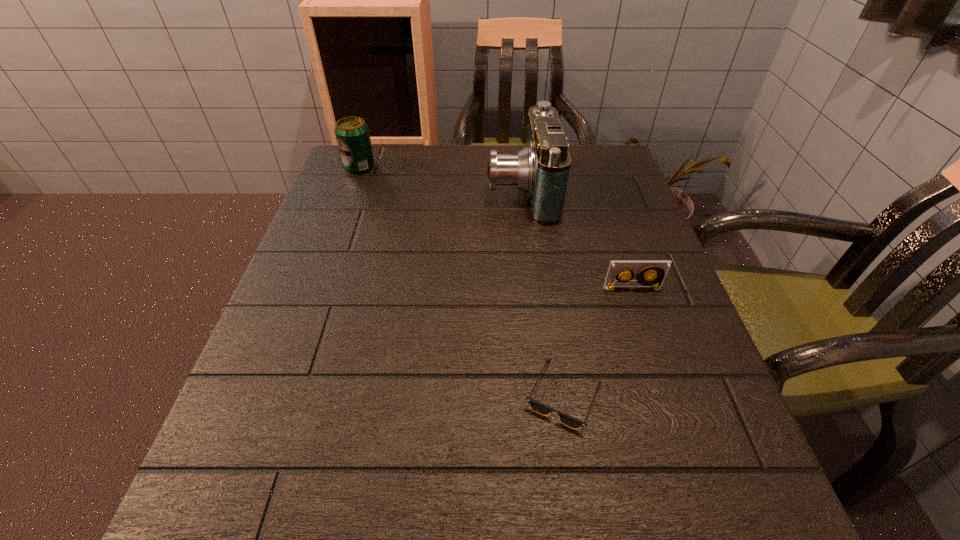
Where is `vacant space at the left edge of the desktop`? Image resolution: width=960 pixels, height=540 pixels. vacant space at the left edge of the desktop is located at coordinates (376, 236).

This screenshot has width=960, height=540. Find the location of `vacant point at the right edge`. vacant point at the right edge is located at coordinates (600, 256).

At what (x,y) coordinates should I click in order to perform the action: click on vacant space at the far left corner. Please return your answer as a coordinate pair (x, y). This screenshot has width=960, height=540. Looking at the image, I should click on (384, 161).

In the image, there is a desktop. Where is `vacant space at the far right corner`? Image resolution: width=960 pixels, height=540 pixels. vacant space at the far right corner is located at coordinates (602, 147).

This screenshot has height=540, width=960. I want to click on free space at the near right corner, so click(741, 512).

Locate an element on the screen. The height and width of the screenshot is (540, 960). vacant point located between the shortest object and the tallest object is located at coordinates (542, 292).

At what (x,y) coordinates should I click in order to perform the action: click on vacant area that lies between the second nearest object and the second tallest object. Please return your answer as a coordinate pair (x, y). Image resolution: width=960 pixels, height=540 pixels. Looking at the image, I should click on (496, 228).

Locate an element on the screen. Image resolution: width=960 pixels, height=540 pixels. free spot between the shortest object and the leftmost object is located at coordinates (462, 281).

Where is `blank region between the second nearest object and the beer can`? blank region between the second nearest object and the beer can is located at coordinates (496, 228).

At what (x,y) coordinates should I click in order to perform the action: click on free space between the third shortest object and the rightmost object. Please return your answer as a coordinate pair (x, y). The image size is (960, 540). Looking at the image, I should click on (496, 228).